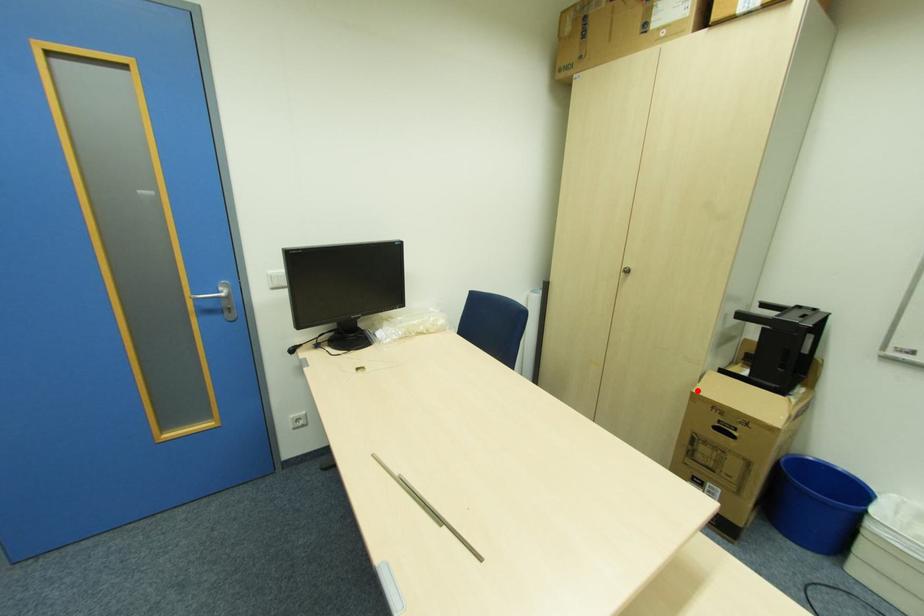
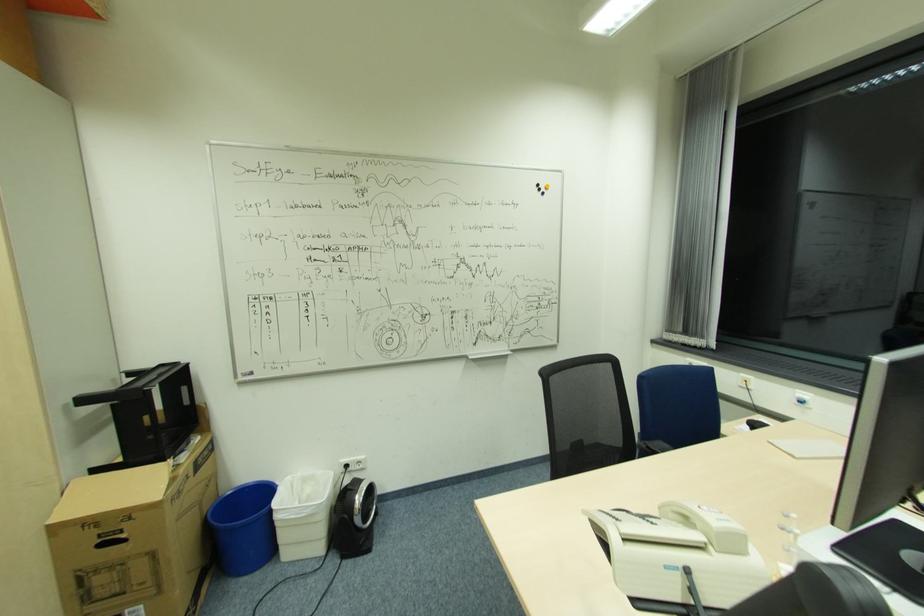
Question: A red point is marked in image1. In image2, is the corresponding 3D point closer to the camera or farther? Reply with the corresponding letter.

Choices:
 (A) The corresponding 3D point is closer.
 (B) The corresponding 3D point is farther.

Answer: (A)